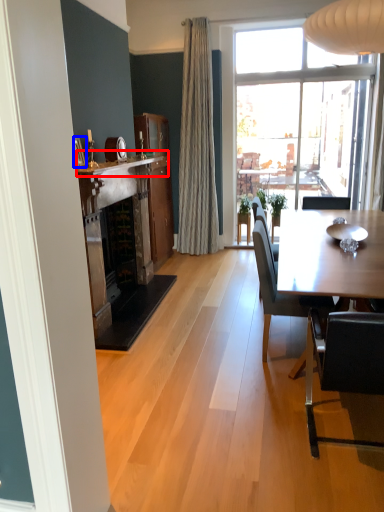
Question: Which point is further to the camera, mantle (highlighted by a red box) or picture frame (highlighted by a blue box)?

Choices:
 (A) mantle
 (B) picture frame

Answer: (B)